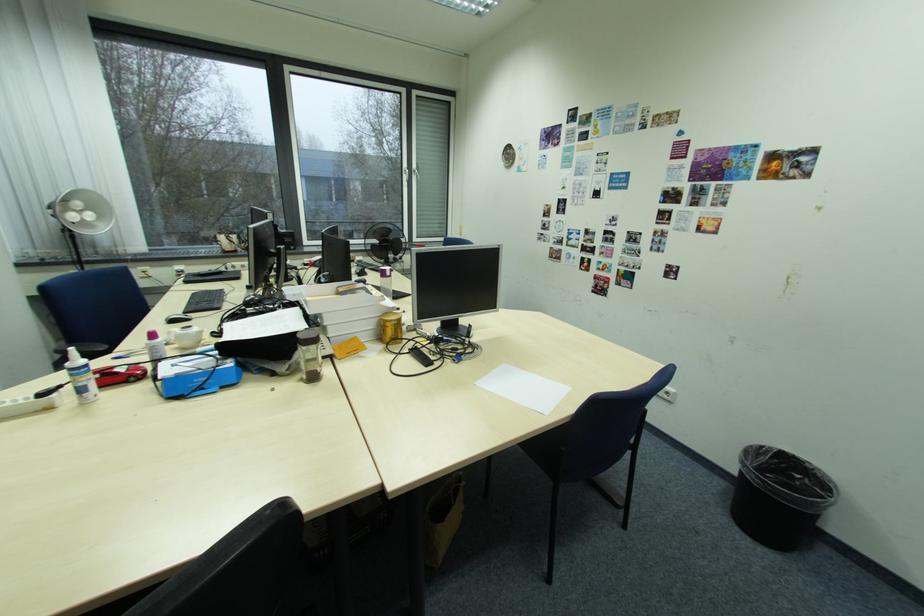
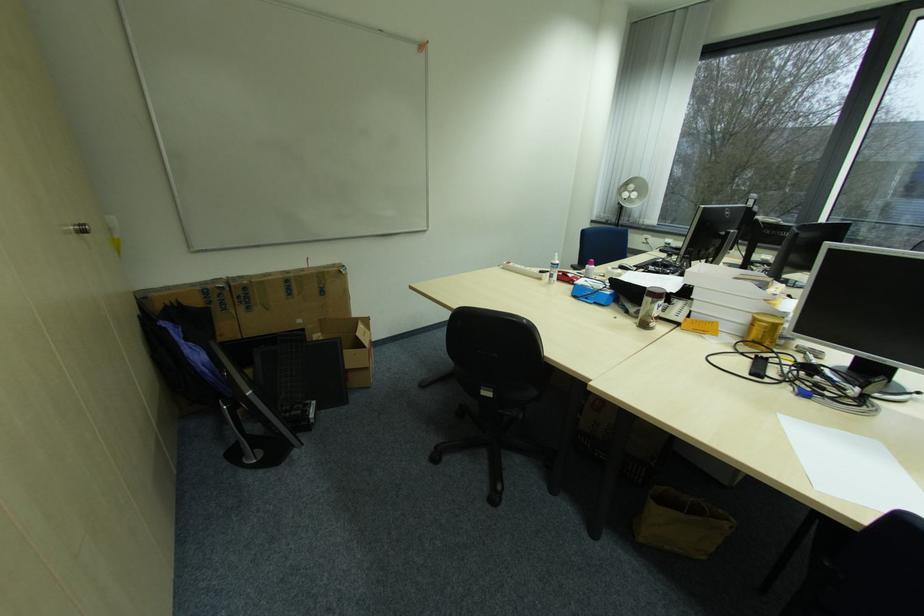
Locate, in the second image, the point that corresponds to point (403, 325) in the first image.

(773, 329)